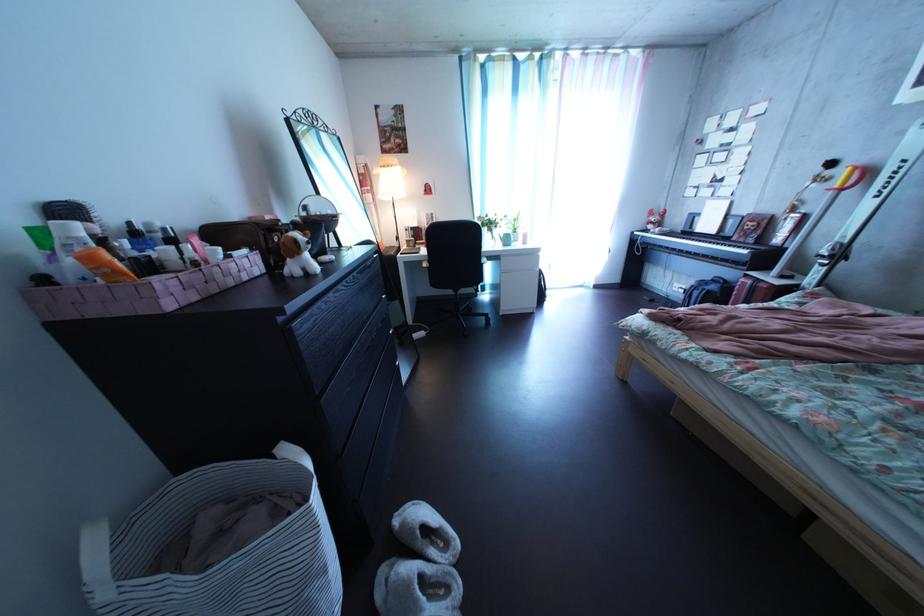
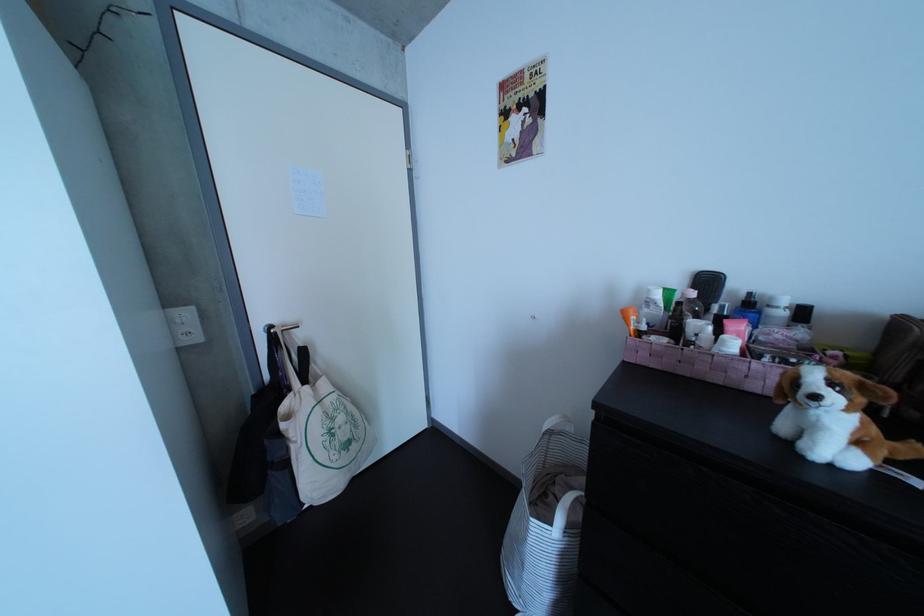
In the second image, find the point that corresponds to the point at 241,264 in the first image.

(764, 362)